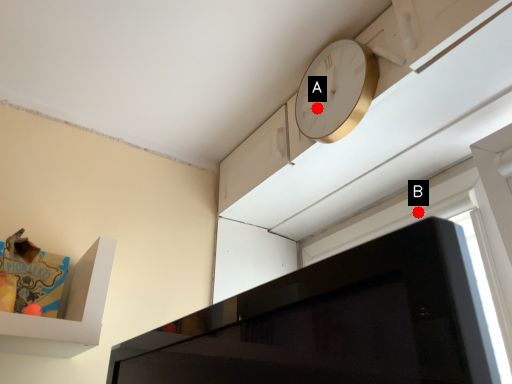
Question: Two points are circled on the image, labeled by A and B beside each circle. Which point is farther to the camera?

Choices:
 (A) A is further
 (B) B is further

Answer: (B)